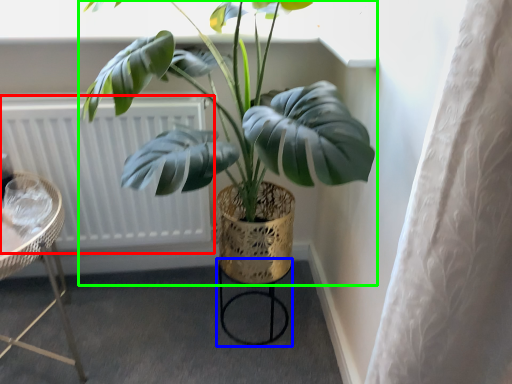
Question: Which is farther away from radiator (highlighted by a red box)? bar stool (highlighted by a blue box) or houseplant (highlighted by a green box)?

Choices:
 (A) bar stool
 (B) houseplant

Answer: (A)